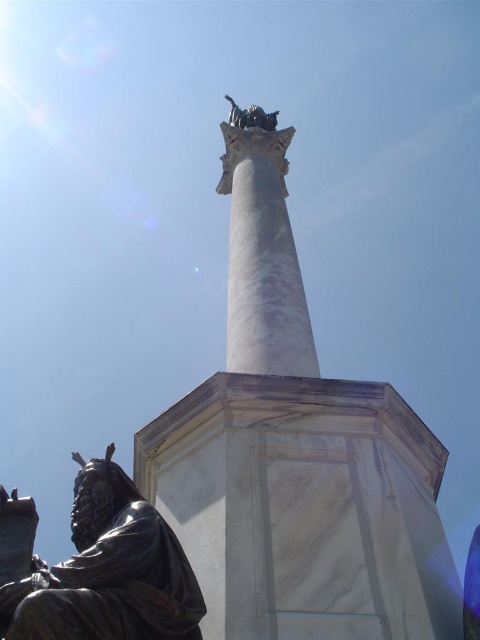
Question: Among these objects, which one is farthest from the camera?

Choices:
 (A) white marble column at center
 (B) bronze statue at top
 (C) bronze statue at lower left

Answer: (B)

Question: From the image, what is the correct spatial relationship of white marble column at center in relation to bronze statue at top?

Choices:
 (A) below
 (B) above

Answer: (A)

Question: Which of the following is the farthest from the observer?

Choices:
 (A) bronze statue at top
 (B) bronze statue at lower left

Answer: (A)

Question: Is bronze statue at lower left below bronze statue at top?

Choices:
 (A) no
 (B) yes

Answer: (B)

Question: Which object is positioned closest to the bronze statue at top?

Choices:
 (A) bronze statue at lower left
 (B) white marble column at center

Answer: (B)

Question: Can you confirm if white marble column at center is positioned above bronze statue at top?

Choices:
 (A) yes
 (B) no

Answer: (B)